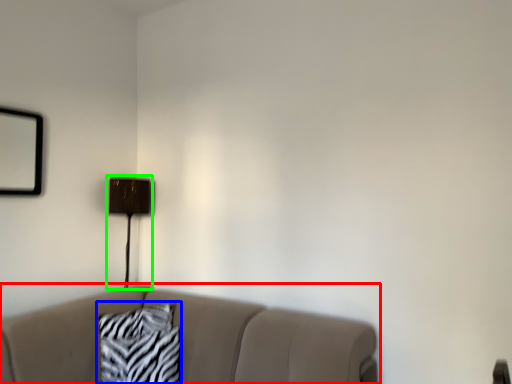
Question: Which object is positioned farthest from studio couch (highlighted by a red box)? Select from pillow (highlighted by a blue box) and table lamp (highlighted by a green box).

Choices:
 (A) pillow
 (B) table lamp

Answer: (B)